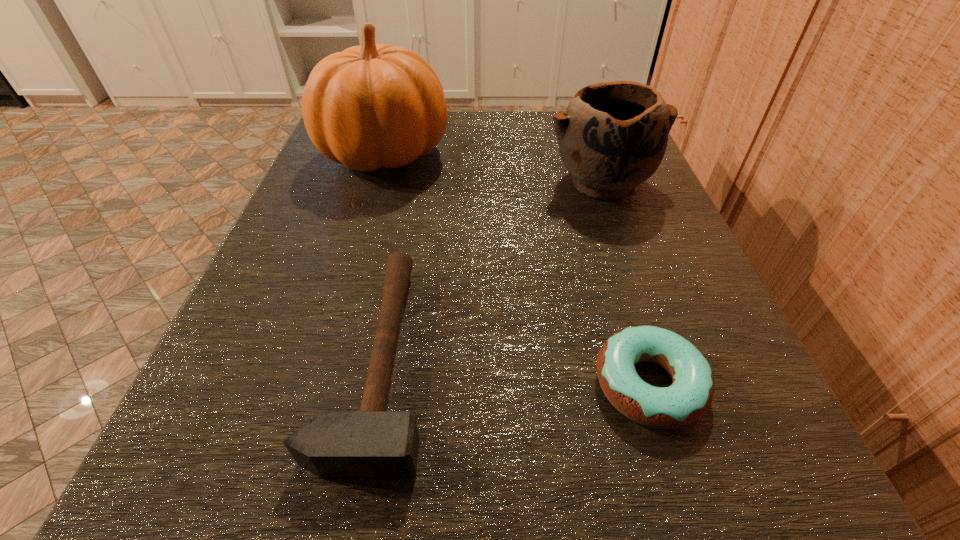
What are the coordinates of `object that is at the near edge` in the screenshot? It's located at (371, 444).

In order to click on pumpkin that is at the left edge in this screenshot , I will do `click(371, 106)`.

Locate an element on the screen. hammer that is positioned at the left edge is located at coordinates (371, 444).

You are a GUI agent. You are given a task and a screenshot of the screen. Output one action in this format:
    pyautogui.click(x=<x>, y=<y>)
    Task: Click on the pottery that is at the right edge
    This screenshot has width=960, height=540.
    Given the screenshot: What is the action you would take?
    pyautogui.click(x=612, y=137)

The image size is (960, 540). Find the location of `doughnut present at the right edge`. doughnut present at the right edge is located at coordinates (689, 397).

Image resolution: width=960 pixels, height=540 pixels. I want to click on object at the far left corner, so click(x=371, y=106).

You are a GUI agent. You are given a task and a screenshot of the screen. Output one action in this format:
    pyautogui.click(x=<x>, y=<y>)
    Task: Click on the object that is positioned at the near left corner
    The height and width of the screenshot is (540, 960).
    Given the screenshot: What is the action you would take?
    pyautogui.click(x=371, y=444)

You are a GUI agent. You are given a task and a screenshot of the screen. Output one action in this format:
    pyautogui.click(x=<x>, y=<y>)
    Task: Click on the object situated at the far right corner
    The width and height of the screenshot is (960, 540).
    Given the screenshot: What is the action you would take?
    pyautogui.click(x=612, y=137)

I want to click on vacant position at the far edge of the desktop, so click(x=509, y=116).

Locate an element on the screen. This screenshot has width=960, height=540. free space at the left edge of the desktop is located at coordinates (339, 251).